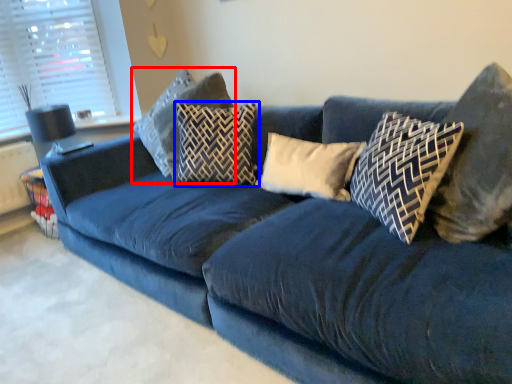
Question: Which object is further to the camera taking this photo, pillow (highlighted by a red box) or pillow (highlighted by a blue box)?

Choices:
 (A) pillow
 (B) pillow

Answer: (A)